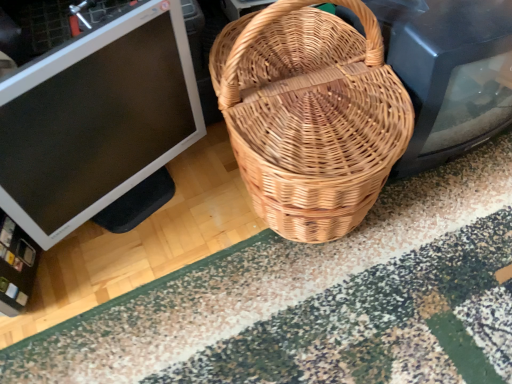
Locate an element on the screen. vacant space underneath matte black monitor at left (from a real-world perspective) is located at coordinates (139, 203).